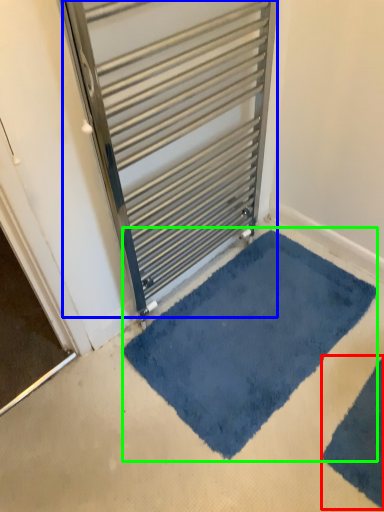
Question: Which object is the closest to the bath mat (highlighted by a red box)? Choose among these: door (highlighted by a blue box) or bath mat (highlighted by a green box).

Choices:
 (A) door
 (B) bath mat

Answer: (B)